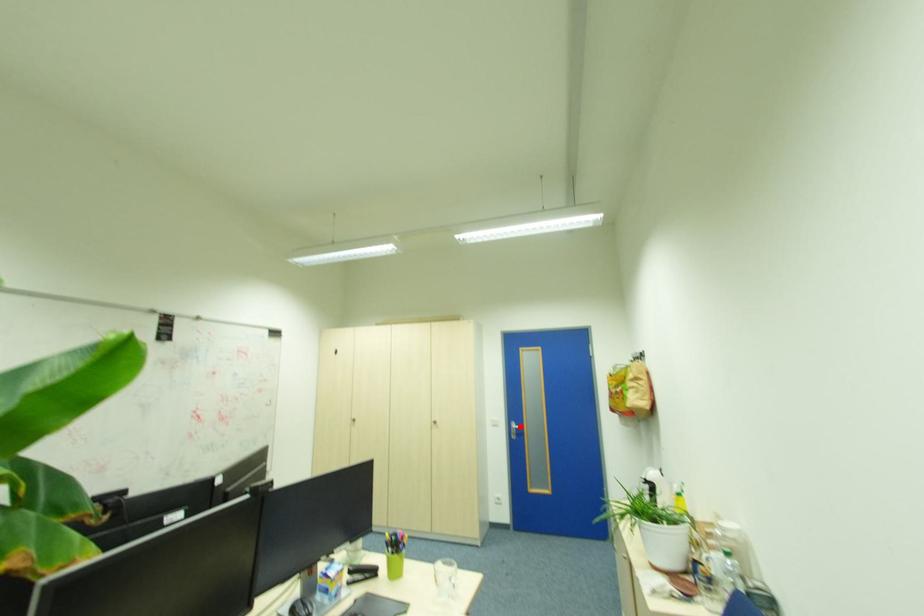
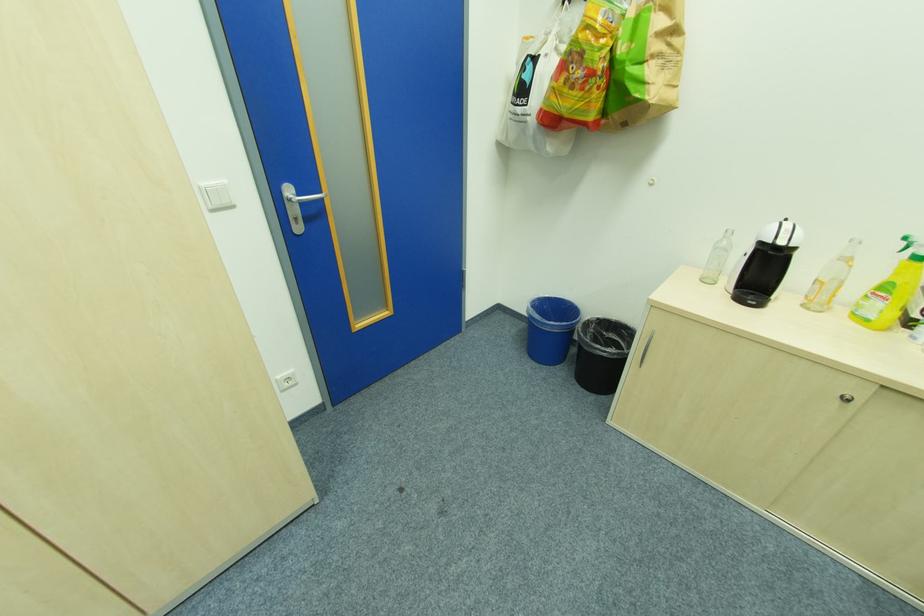
Locate, in the second image, the point that corresponds to the highlighted location in the first image.

(304, 196)